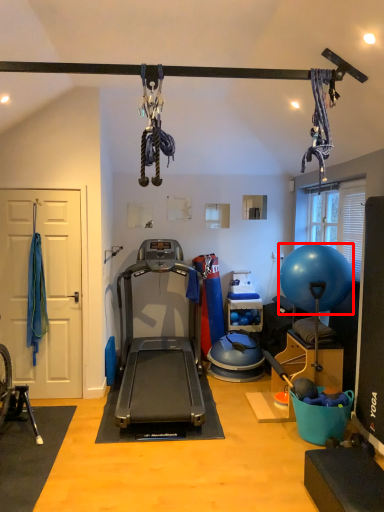
Question: From the image's perspective, what is the correct spatial positioning of ball (annotated by the red box) in reference to treadmill?

Choices:
 (A) above
 (B) below

Answer: (A)